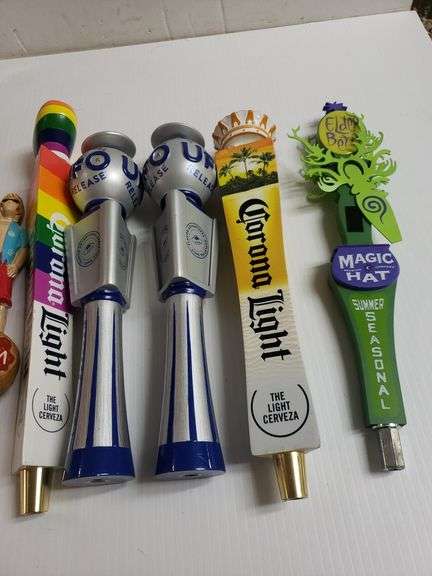
Where is `tap handles`? The height and width of the screenshot is (576, 432). tap handles is located at coordinates (368, 319), (273, 319), (194, 271), (104, 266), (53, 266), (11, 259).